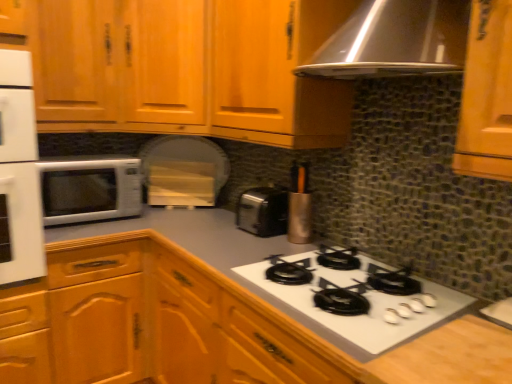
Question: From the image's perspective, relative to satin silver toaster at center, is metallic silver utensil holder at upper center above or below?

Choices:
 (A) below
 (B) above

Answer: (B)

Question: Is metallic silver utensil holder at upper center spatially inside satin silver toaster at center, or outside of it?

Choices:
 (A) inside
 (B) outside

Answer: (B)

Question: Estimate the real-world distances between objects in this image. Which object is farther from the white glossy microwave at left?

Choices:
 (A) white glossy gas stove at center
 (B) white glossy sink at lower right
 (C) satin silver toaster at center
 (D) wooden cabinet at center, the first cabinetry ordered from the bottom
 (E) metallic silver utensil holder at upper center

Answer: (B)

Question: Which object is positioned closest to the white glossy microwave at left?

Choices:
 (A) white glossy gas stove at center
 (B) wooden cabinet at upper left, which is counted as the first cabinetry, starting from the top
 (C) satin silver toaster at center
 (D) wooden cabinet at center, the first cabinetry ordered from the bottom
 (E) metallic silver utensil holder at upper center

Answer: (B)